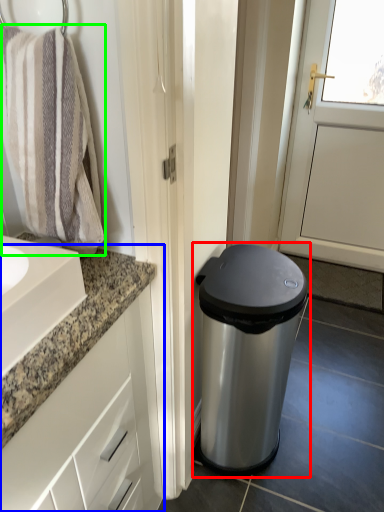
Question: Estimate the real-world distances between objects in this image. Which object is farther from waste container (highlighted by a red box), bathroom cabinet (highlighted by a blue box) or bath towel (highlighted by a green box)?

Choices:
 (A) bathroom cabinet
 (B) bath towel

Answer: (B)